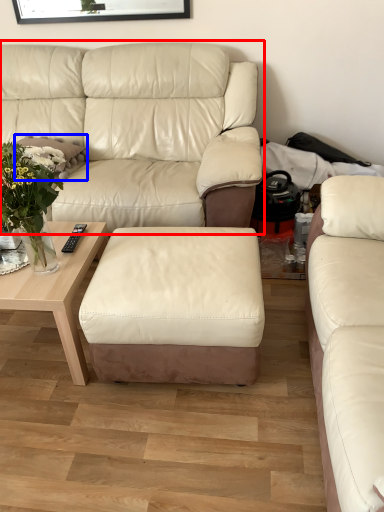
Question: Which object is further to the camera taking this photo, studio couch (highlighted by a red box) or pillow (highlighted by a blue box)?

Choices:
 (A) studio couch
 (B) pillow

Answer: (B)